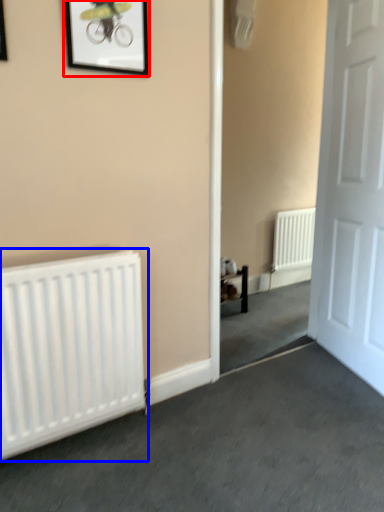
Question: Which point is closer to the camera, picture frame (highlighted by a red box) or radiator (highlighted by a blue box)?

Choices:
 (A) picture frame
 (B) radiator

Answer: (B)